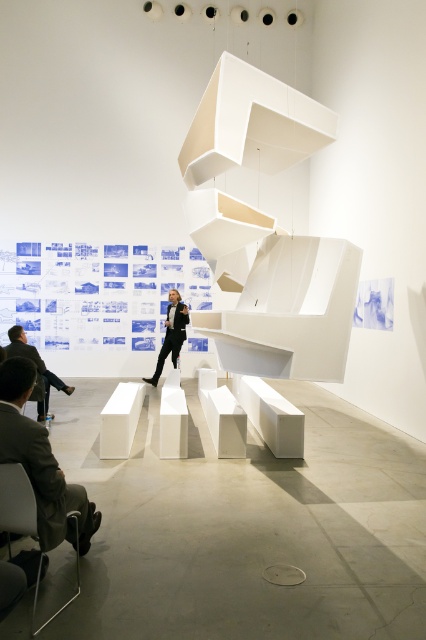
Is point (23, 342) closer to viewer compared to point (166, 320)?

Yes, point (23, 342) is closer to viewer.

Is the position of matte black suit at lower left less distant than that of black suit at center?

That is True.

Which is in front, point (37, 390) or point (167, 342)?

Point (37, 390) is more forward.

Image resolution: width=426 pixels, height=640 pixels. In order to click on matte black suit at lower left in this screenshot , I will do `click(37, 369)`.

Is point (74, 502) positioned in front of point (175, 300)?

That is True.

Is dark gray suit at lower left thinner than black suit at center?

Yes.

Between point (0, 426) and point (178, 310), which one is positioned behind?

The point (178, 310) is behind.

The height and width of the screenshot is (640, 426). I want to click on dark gray suit at lower left, so click(40, 461).

Can you confirm if metallic gray chair at lower left is bigger than black suit at center?

No, metallic gray chair at lower left is not bigger than black suit at center.

Measure the distance between metallic gray chair at lower left and camera.

metallic gray chair at lower left and camera are 2.12 meters apart.

Find the location of a particular element. metallic gray chair at lower left is located at coordinates (17, 500).